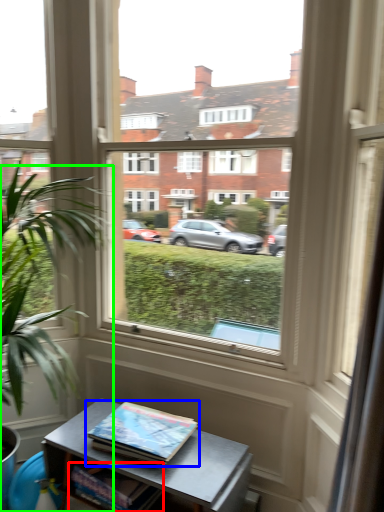
Question: Based on their relative distances, which object is nearer to book (highlighted by a red box)? Choose from book (highlighted by a blue box) and houseplant (highlighted by a green box).

Choices:
 (A) book
 (B) houseplant

Answer: (A)